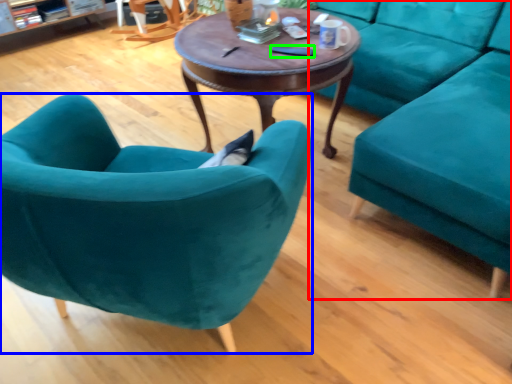
Question: Estimate the real-world distances between objects in this image. Which object is farther from studio couch (highlighted by a red box), chair (highlighted by a blue box) or remote control (highlighted by a green box)?

Choices:
 (A) chair
 (B) remote control

Answer: (A)